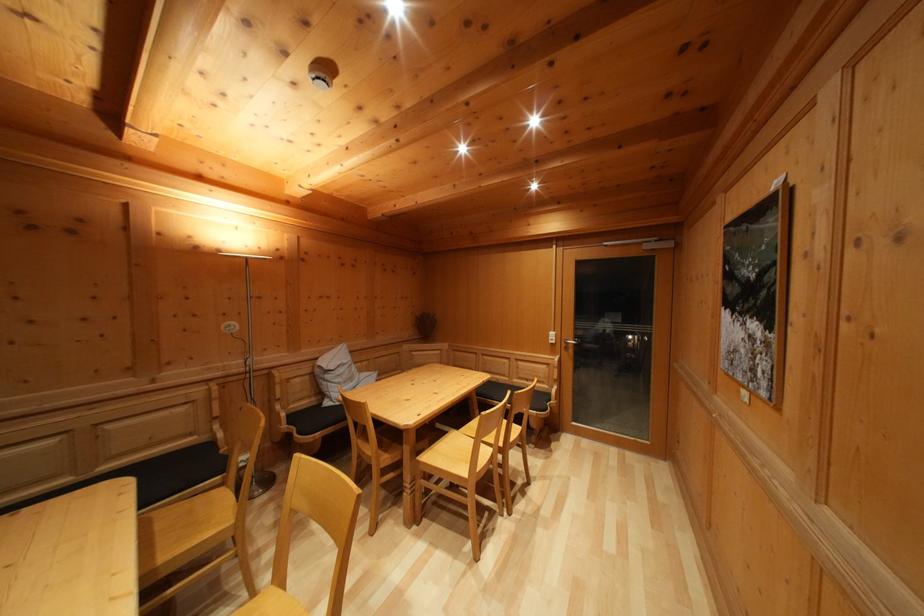
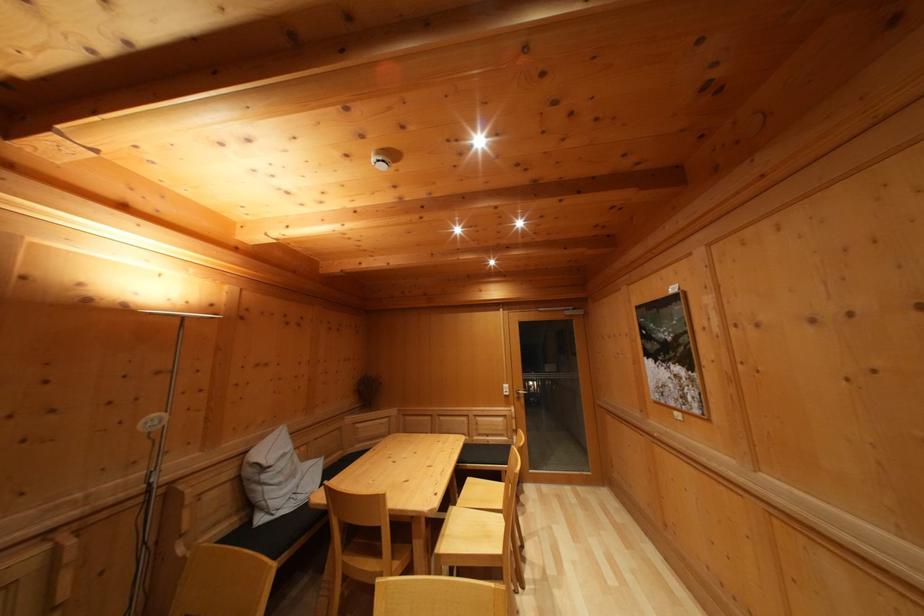
Question: The first image is from the beginning of the video and the second image is from the end. How did the camera likely rotate when shooting the video?

Choices:
 (A) Left
 (B) Right
 (C) Up
 (D) Down

Answer: (B)